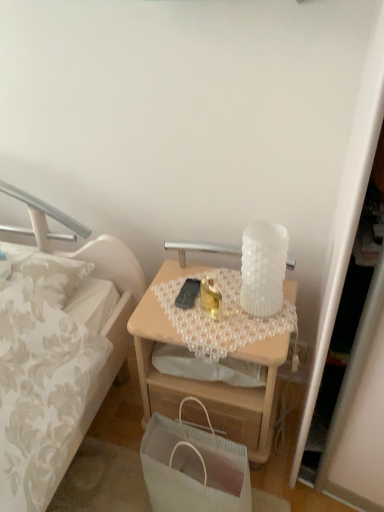
Find the location of a particular element. This screenshot has height=512, width=384. vacant area that lies to the right of black matte mobile phone at center is located at coordinates (238, 300).